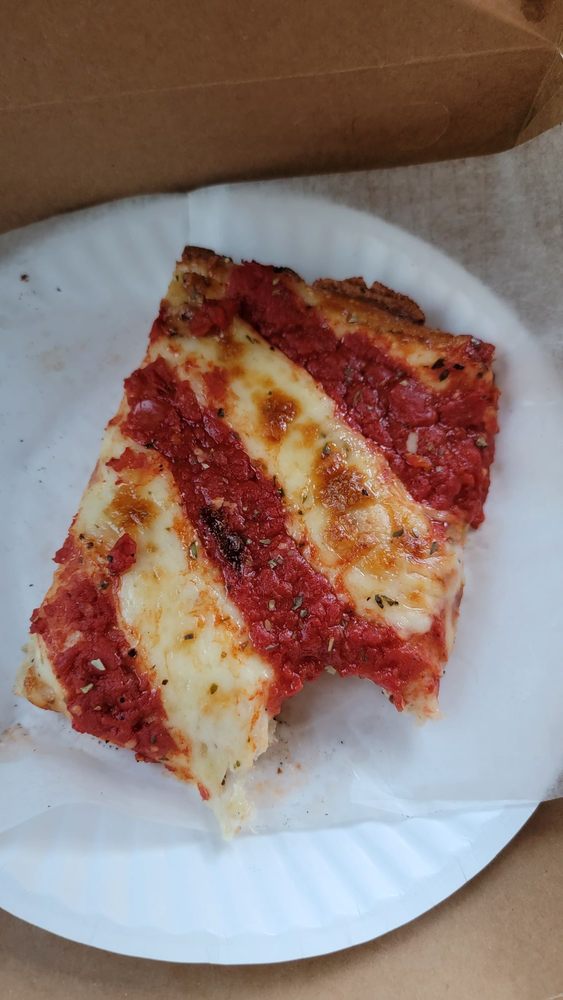
Identify the location of paper plate. (386, 854).